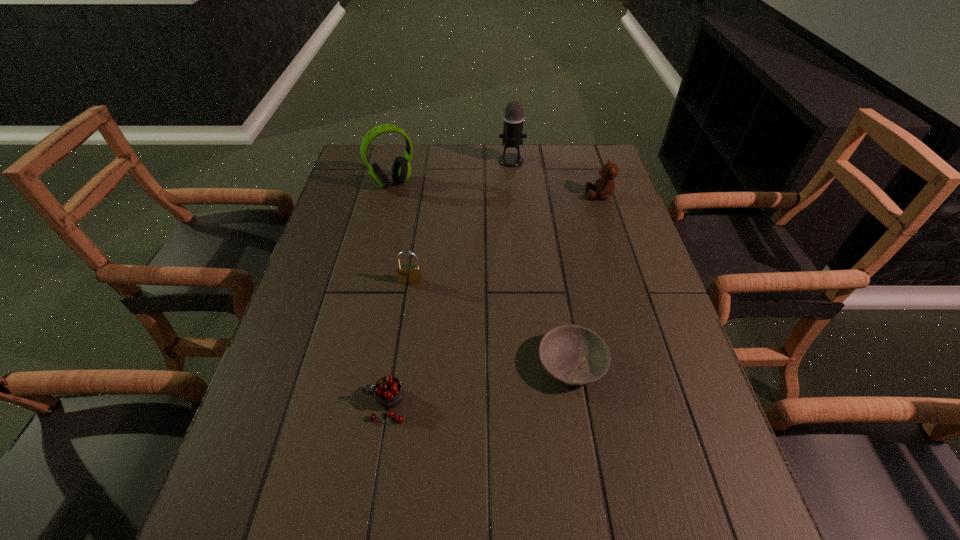
Identify the location of the farthest object. The width and height of the screenshot is (960, 540). (512, 136).

The width and height of the screenshot is (960, 540). I want to click on headset, so click(x=401, y=169).

Locate an element on the screen. The image size is (960, 540). the rightmost object is located at coordinates (604, 186).

Identify the location of the third nearest object. (407, 274).

This screenshot has width=960, height=540. What are the coordinates of `the fifth tallest object` in the screenshot? It's located at (388, 391).

In order to click on the shortest object in this screenshot , I will do `click(574, 355)`.

Image resolution: width=960 pixels, height=540 pixels. Identify the location of vacant point located on the left of the microphone. (469, 161).

Find the location of `vacant space situated on the right of the headset`. vacant space situated on the right of the headset is located at coordinates (481, 184).

Where is `free space located 0.240m on the face of the teddy bear`? Image resolution: width=960 pixels, height=540 pixels. free space located 0.240m on the face of the teddy bear is located at coordinates (510, 195).

At what (x,y) coordinates should I click in order to perform the action: click on free space located on the face of the teddy bear. Please return your answer as a coordinate pair (x, y). Image resolution: width=960 pixels, height=540 pixels. Looking at the image, I should click on (478, 195).